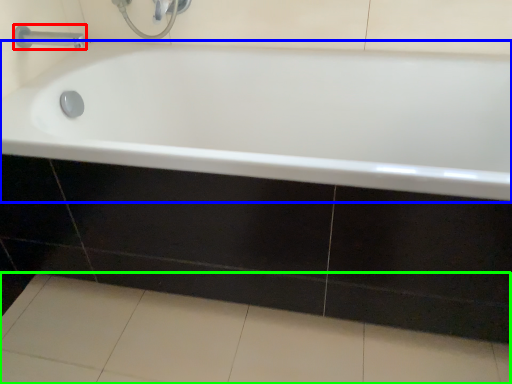
Question: Based on their relative distances, which object is farther from tap (highlighted by a red box)? Choose from bathtub (highlighted by a blue box) and ceramic tile (highlighted by a green box).

Choices:
 (A) bathtub
 (B) ceramic tile

Answer: (B)